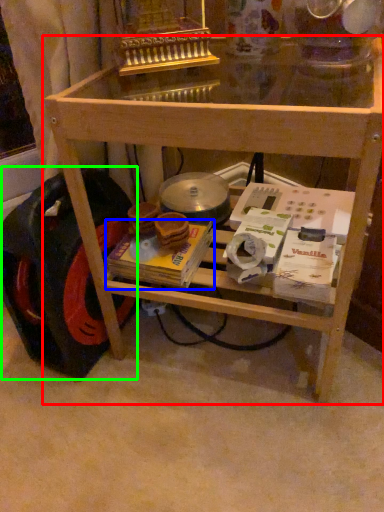
Question: Which object is positioned farthest from table (highlighted by a red box)? Select from magazine (highlighted by a blue box) and wheel (highlighted by a green box).

Choices:
 (A) magazine
 (B) wheel

Answer: (A)